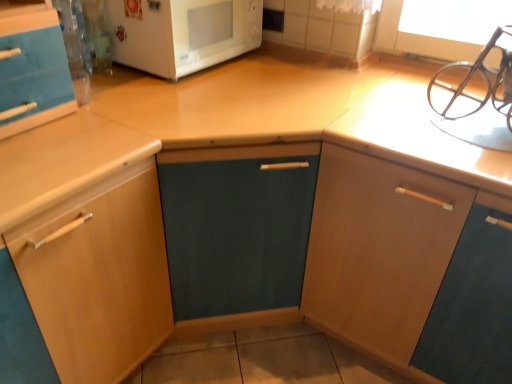
Question: Is wooden cabinet at left, positioned as the 1th cabinetry in left-to-right order, far from white glossy microwave at upper center?

Choices:
 (A) no
 (B) yes

Answer: (A)

Question: From the image's perspective, does wooden cabinet at left, positioned as the 1th cabinetry in left-to-right order, appear higher than white glossy microwave at upper center?

Choices:
 (A) no
 (B) yes

Answer: (A)

Question: Would you say wooden cabinet at left, positioned as the 1th cabinetry in left-to-right order, contains white glossy microwave at upper center?

Choices:
 (A) yes
 (B) no

Answer: (B)

Question: Is wooden cabinet at left, positioned as the 1th cabinetry in left-to-right order, taller than white glossy microwave at upper center?

Choices:
 (A) no
 (B) yes

Answer: (B)

Question: From the image's perspective, would you say wooden cabinet at left, positioned as the 1th cabinetry in left-to-right order, is shown under white glossy microwave at upper center?

Choices:
 (A) no
 (B) yes

Answer: (B)

Question: From the image's perspective, is metallic silver sink at upper right located above or below wooden cabinet at upper right, the 1th cabinetry viewed from the right?

Choices:
 (A) below
 (B) above

Answer: (B)

Question: In the image, is metallic silver sink at upper right on the left side or the right side of wooden cabinet at upper right, which appears as the 2th cabinetry when viewed from the left?

Choices:
 (A) right
 (B) left

Answer: (B)

Question: Is metallic silver sink at upper right inside or outside of wooden cabinet at upper right, which appears as the 2th cabinetry when viewed from the left?

Choices:
 (A) outside
 (B) inside

Answer: (A)

Question: In the image, is metallic silver sink at upper right positioned in front of or behind wooden cabinet at upper right, the 1th cabinetry viewed from the right?

Choices:
 (A) front
 (B) behind

Answer: (B)

Question: Is wooden cabinet at left, positioned as the 1th cabinetry in left-to-right order, taller or shorter than metallic silver sink at upper right?

Choices:
 (A) short
 (B) tall

Answer: (B)

Question: Considering the positions of wooden cabinet at left, the second cabinetry viewed from the right, and metallic silver sink at upper right in the image, is wooden cabinet at left, the second cabinetry viewed from the right, bigger or smaller than metallic silver sink at upper right?

Choices:
 (A) small
 (B) big

Answer: (B)

Question: From the image's perspective, is wooden cabinet at left, the second cabinetry viewed from the right, above or below metallic silver sink at upper right?

Choices:
 (A) above
 (B) below

Answer: (B)

Question: Is wooden cabinet at left, the second cabinetry viewed from the right, wider or thinner than metallic silver sink at upper right?

Choices:
 (A) thin
 (B) wide

Answer: (B)

Question: Relative to white glossy microwave at upper center, is wooden cabinet at left, positioned as the 1th cabinetry in left-to-right order, in front or behind?

Choices:
 (A) front
 (B) behind

Answer: (A)

Question: From the image's perspective, is wooden cabinet at left, the second cabinetry viewed from the right, positioned above or below white glossy microwave at upper center?

Choices:
 (A) below
 (B) above

Answer: (A)